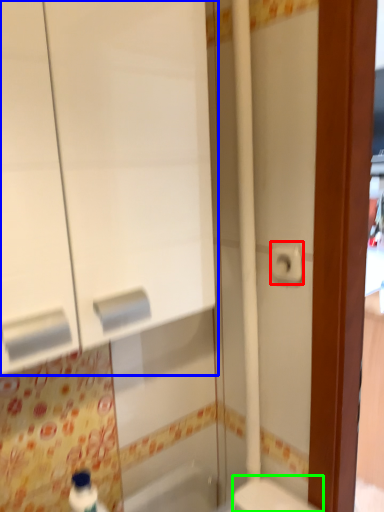
Question: Considering the real-world distances, which object is closest to toilet paper (highlighted by a red box)? medicine cabinet (highlighted by a blue box) or toilet (highlighted by a green box).

Choices:
 (A) medicine cabinet
 (B) toilet

Answer: (A)